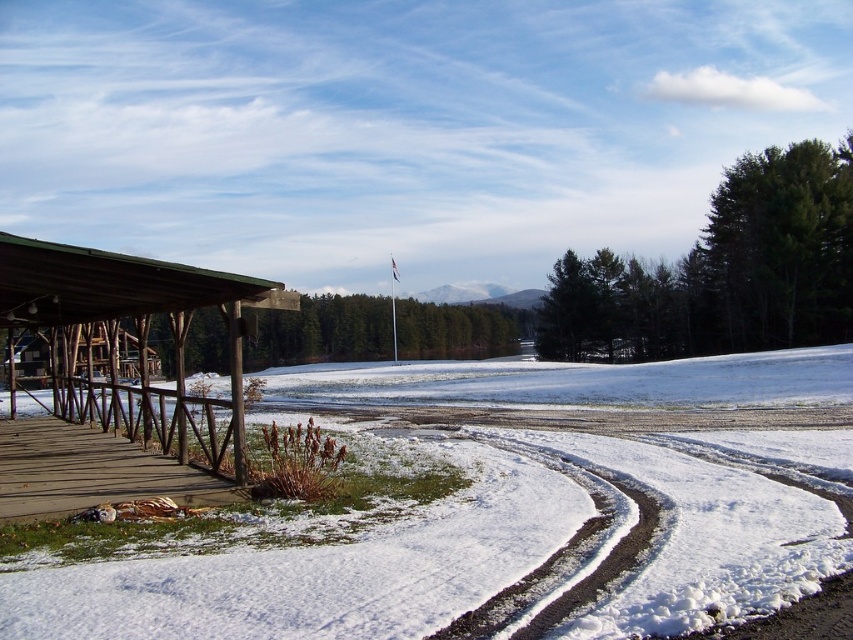
Question: Which point is closer to the camera?

Choices:
 (A) tap(291, 385)
 (B) tap(236, 432)

Answer: (B)

Question: Is white powdery snow at lower left wider than brown wooden hut at left?

Choices:
 (A) yes
 (B) no

Answer: (A)

Question: Is white powdery snow at lower left positioned behind wooden planks at lower left?

Choices:
 (A) yes
 (B) no

Answer: (B)

Question: Is brown wooden hut at left below wooden planks at lower left?

Choices:
 (A) no
 (B) yes

Answer: (A)

Question: Among these points, which one is nearest to the camera?

Choices:
 (A) (0, 307)
 (B) (45, 438)

Answer: (B)

Question: Among these points, which one is farthest from the camera?

Choices:
 (A) (109, 497)
 (B) (512, 385)
 (C) (225, 294)

Answer: (B)